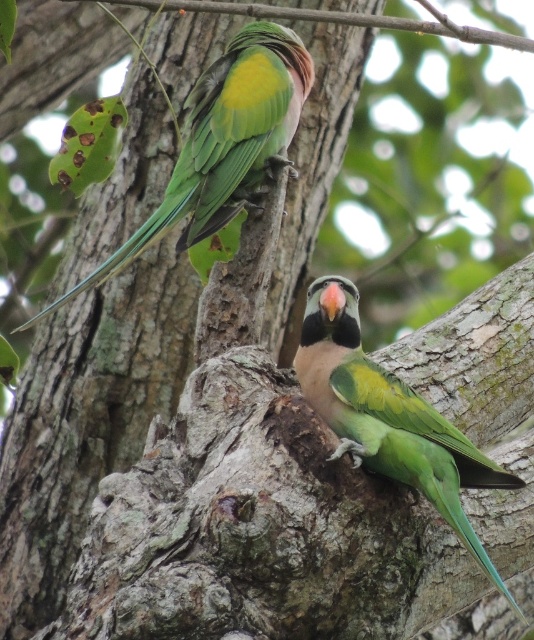
Is green matte parrot at center shorter than green matte parrot at upper left?

Correct, green matte parrot at center is not as tall as green matte parrot at upper left.

Between green matte parrot at center and green matte parrot at upper left, which one appears on the left side from the viewer's perspective?

Positioned to the left is green matte parrot at upper left.

Is point (476, 545) positioned in front of point (249, 118)?

Yes, point (476, 545) is in front of point (249, 118).

You are a GUI agent. You are given a task and a screenshot of the screen. Output one action in this format:
    pyautogui.click(x=<x>, y=<y>)
    Task: Click on the green matte parrot at center
    
    Given the screenshot: What is the action you would take?
    pyautogui.click(x=388, y=417)